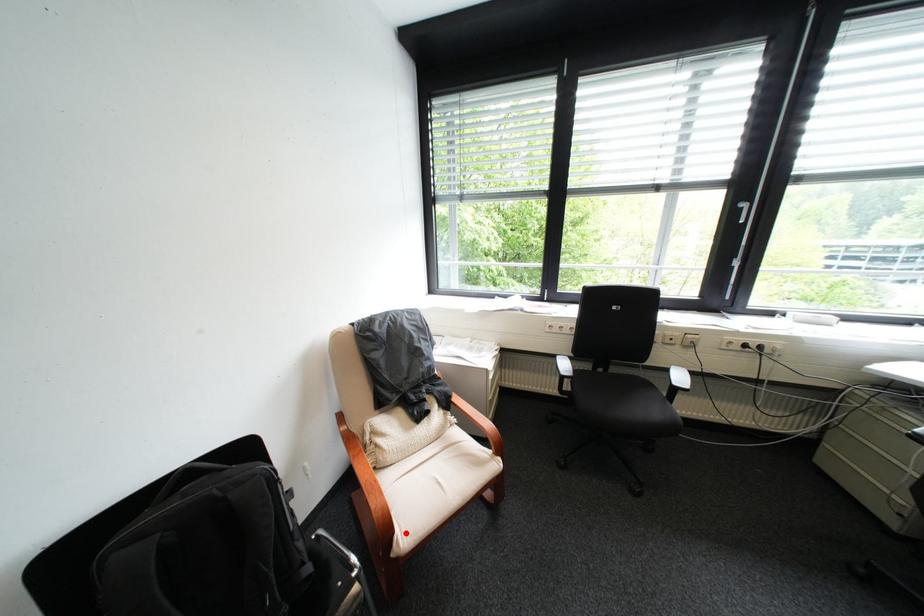
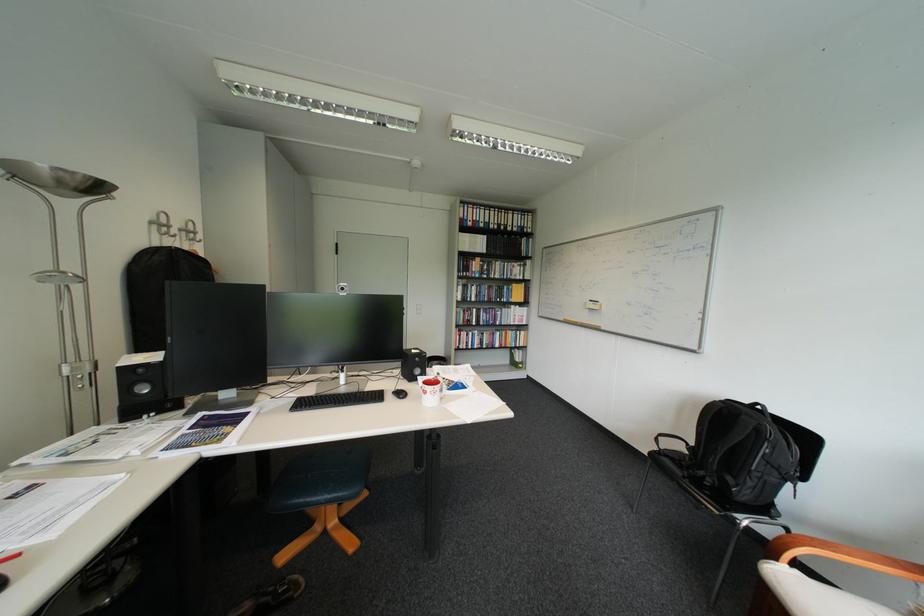
Find the pixel in the second image that matches the highlighted location in the first image.

(788, 560)